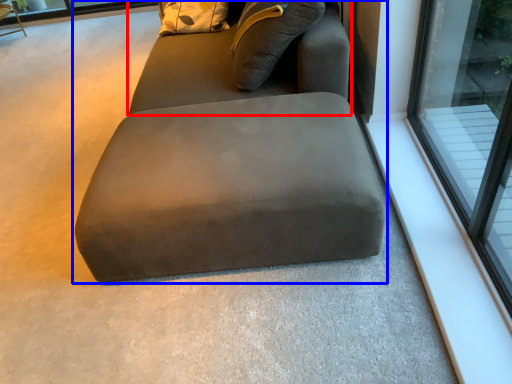
Question: Which object appears closest to the camera in this image, bean bag chair (highlighted by a red box) or studio couch (highlighted by a blue box)?

Choices:
 (A) bean bag chair
 (B) studio couch

Answer: (B)